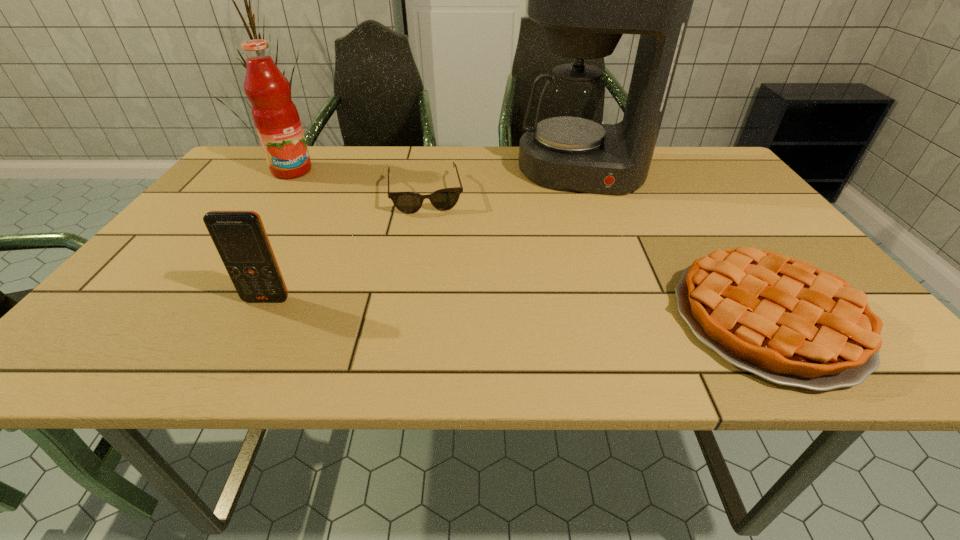
Identify the location of vacant space that's between the tallest object and the third object from left to right. (503, 182).

Where is `object identified as the second closest to the third tallest object`? The width and height of the screenshot is (960, 540). object identified as the second closest to the third tallest object is located at coordinates (275, 116).

The width and height of the screenshot is (960, 540). In order to click on object identified as the second closest to the fruit juice in this screenshot , I will do `click(240, 238)`.

At what (x,y) coordinates should I click in order to perform the action: click on vacant region that satisfies the following two spatial constraints: 1. on the back side of the coffee maker; 2. on the left side of the sunglasses. Please return your answer as a coordinate pair (x, y). This screenshot has width=960, height=540. Looking at the image, I should click on (429, 171).

Identify the location of vacant space that satisfies the following two spatial constraints: 1. on the front side of the third object from left to right; 2. on the left side of the pie. (402, 319).

Where is `vacant space that satisfies the following two spatial constraints: 1. on the front side of the pie; 2. on the right side of the third object from left to right`? This screenshot has width=960, height=540. vacant space that satisfies the following two spatial constraints: 1. on the front side of the pie; 2. on the right side of the third object from left to right is located at coordinates (402, 319).

Where is `vacant region that satisfies the following two spatial constraints: 1. on the back side of the sunglasses; 2. on the left side of the tallest object`? vacant region that satisfies the following two spatial constraints: 1. on the back side of the sunglasses; 2. on the left side of the tallest object is located at coordinates (429, 171).

In order to click on vacant area in the image that satisfies the following two spatial constraints: 1. on the front side of the sunglasses; 2. on the right side of the pie in this screenshot , I will do `click(402, 319)`.